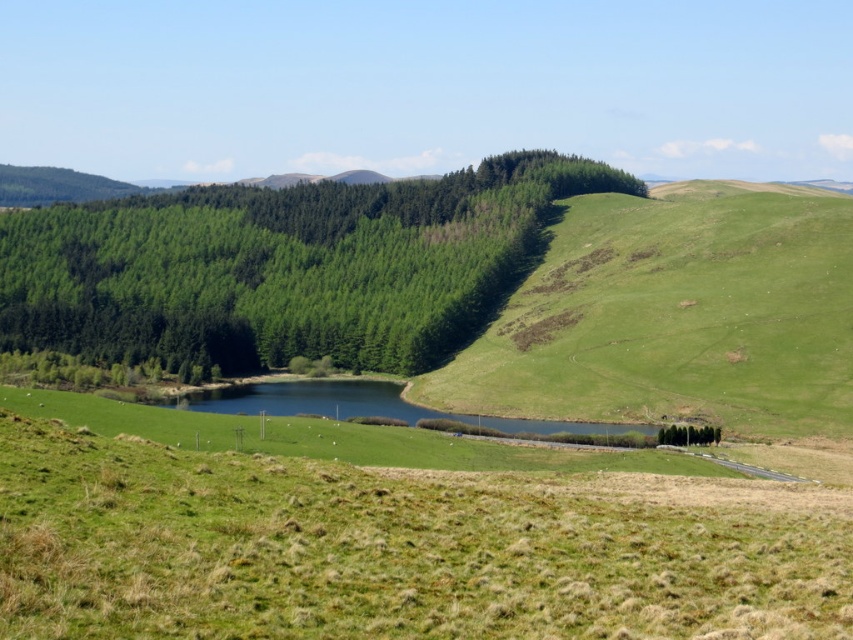
Is point (689, 486) farther from viewer compared to point (688, 225)?

No, it is not.

In the scene shown: Can you confirm if green grass at center is shorter than green grassy hillside at center?

Yes, green grass at center is shorter than green grassy hillside at center.

Identify the location of green grass at center. The width and height of the screenshot is (853, 640). (392, 534).

Does point (318, 282) come closer to viewer compared to point (614, 230)?

That is True.

Does green textured forest at center have a lesser width compared to green grassy hillside at center?

No.

Identify the location of green textured forest at center. This screenshot has width=853, height=640. (285, 266).

Who is taller, green grass at center or green textured forest at center?

green textured forest at center is taller.

Which is more to the left, green grass at center or green textured forest at center?

green textured forest at center

What do you see at coordinates (392, 534) in the screenshot? I see `green grass at center` at bounding box center [392, 534].

At what (x,y) coordinates should I click in order to perform the action: click on green grass at center. Please return your answer as a coordinate pair (x, y). The image size is (853, 640). Looking at the image, I should click on (392, 534).